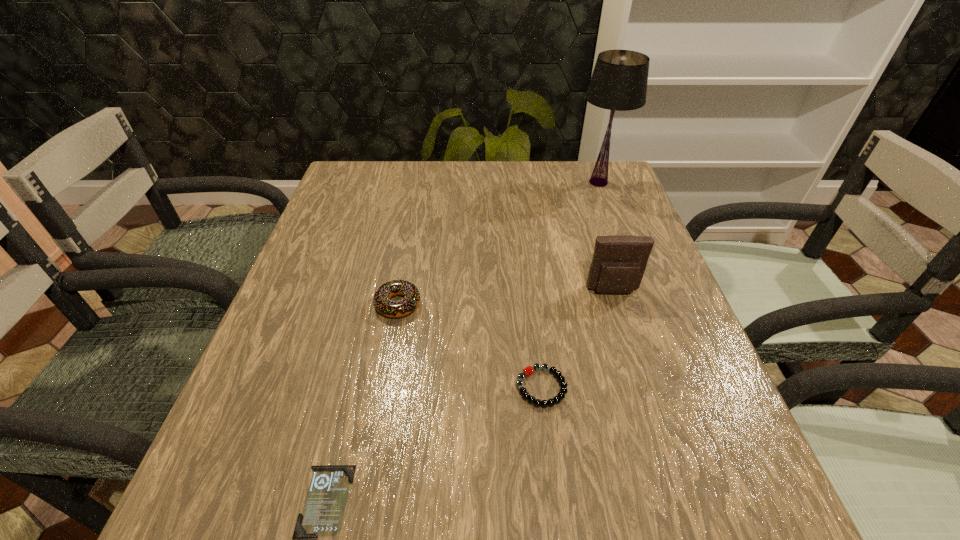
Image resolution: width=960 pixels, height=540 pixels. In order to click on vacant area situated on the front-facing side of the farthest object in this screenshot , I will do (x=488, y=182).

This screenshot has height=540, width=960. Find the location of `vacant space located 0.310m with an open flap on the pouch`. vacant space located 0.310m with an open flap on the pouch is located at coordinates (660, 440).

This screenshot has width=960, height=540. I want to click on vacant space located on the back of the doughnut, so click(x=420, y=190).

Where is `free space located on the back of the bracelet`? This screenshot has height=540, width=960. free space located on the back of the bracelet is located at coordinates (531, 302).

At what (x,y) coordinates should I click in order to perform the action: click on free space located 0.320m on the back of the identity card. Please return your answer as a coordinate pair (x, y). This screenshot has height=540, width=960. Looking at the image, I should click on (372, 309).

What are the coordinates of `object located in the far edge section of the desktop` in the screenshot? It's located at (619, 81).

At what (x,y) coordinates should I click in order to perform the action: click on object that is positioned at the near edge. Please return your answer as a coordinate pair (x, y). Looking at the image, I should click on (322, 515).

This screenshot has width=960, height=540. I want to click on object at the left edge, so click(322, 515).

Locate an element on the screen. Image resolution: width=960 pixels, height=540 pixels. lampshade that is at the right edge is located at coordinates (619, 81).

This screenshot has height=540, width=960. I want to click on pouch located in the right edge section of the desktop, so click(x=619, y=261).